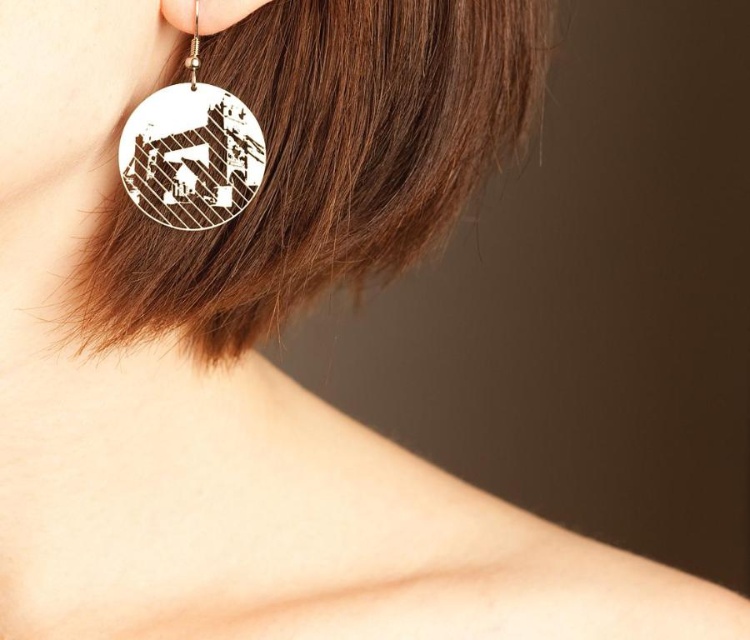
Question: Is brown matte hair at upper left below silver metallic earring at upper left?

Choices:
 (A) no
 (B) yes

Answer: (B)

Question: Which of the following is the closest to the observer?

Choices:
 (A) white wood circle at left
 (B) silver metallic earring at upper left

Answer: (B)

Question: Is brown matte hair at upper left thinner than white wood circle at left?

Choices:
 (A) no
 (B) yes

Answer: (A)

Question: Which object is the farthest from the brown matte hair at upper left?

Choices:
 (A) white wood circle at left
 (B) silver metallic earring at upper left

Answer: (B)

Question: Based on their relative distances, which object is farther from the white wood circle at left?

Choices:
 (A) silver metallic earring at upper left
 (B) brown matte hair at upper left

Answer: (B)

Question: Observing the image, what is the correct spatial positioning of white wood circle at left in reference to silver metallic earring at upper left?

Choices:
 (A) below
 (B) above

Answer: (A)